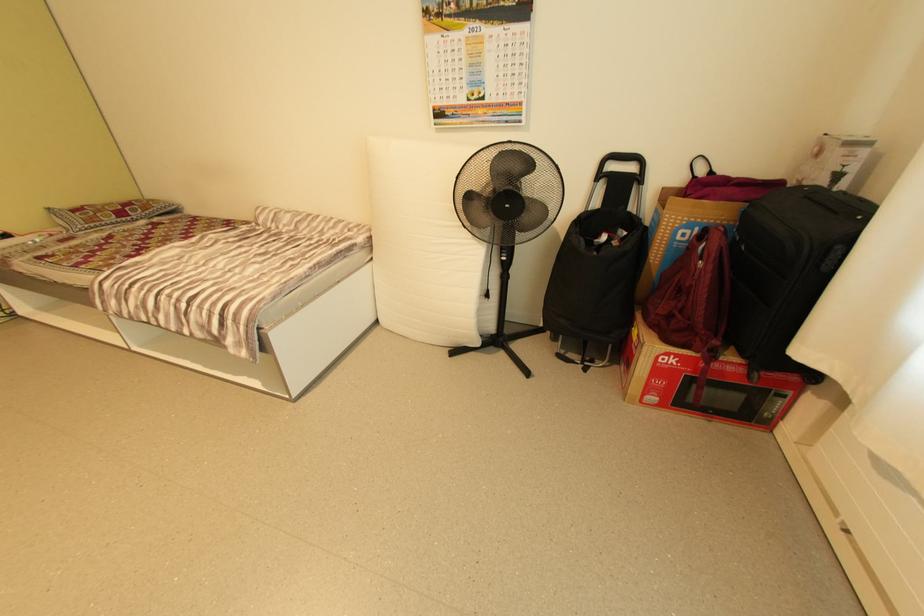
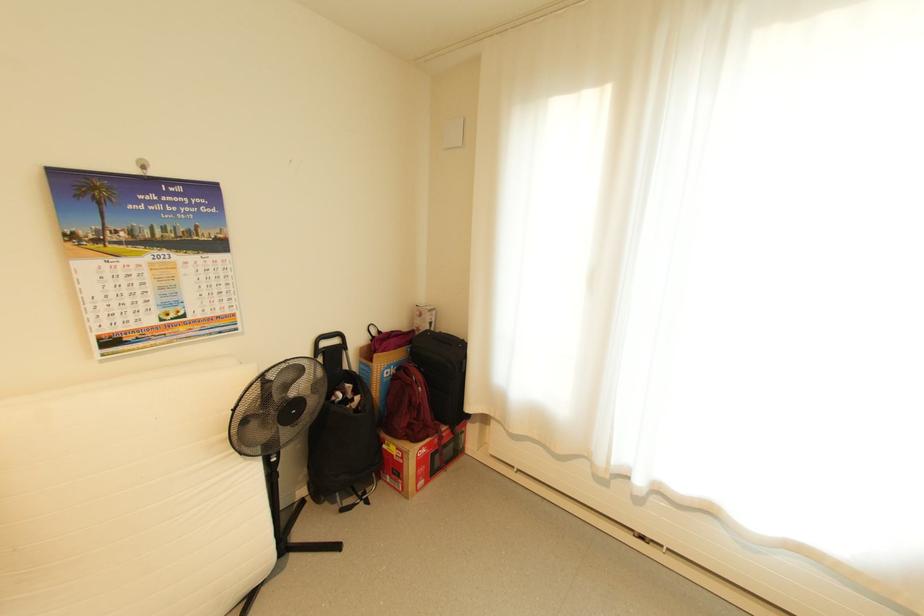
The point at (638, 169) is marked in the first image. Where is the corresponding point in the second image?

(342, 342)